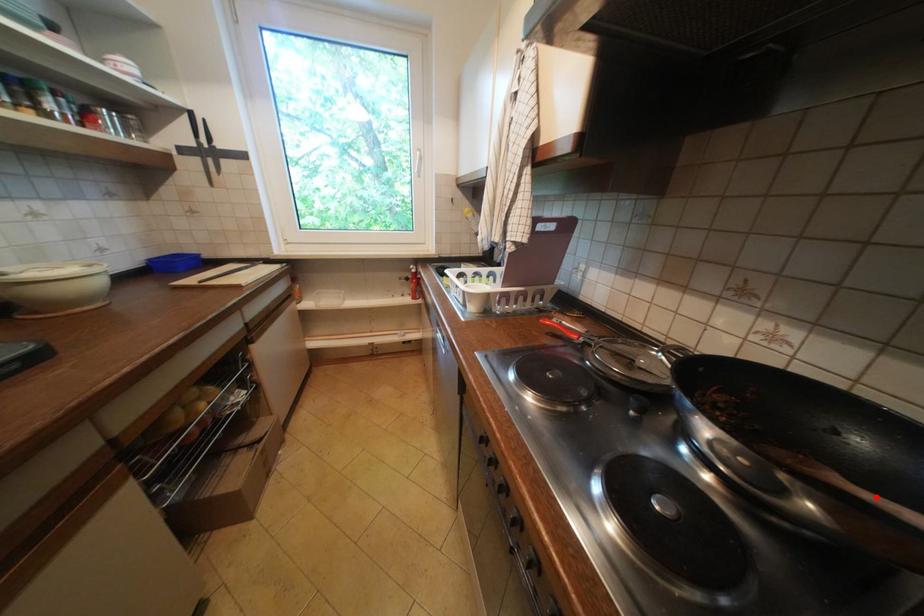
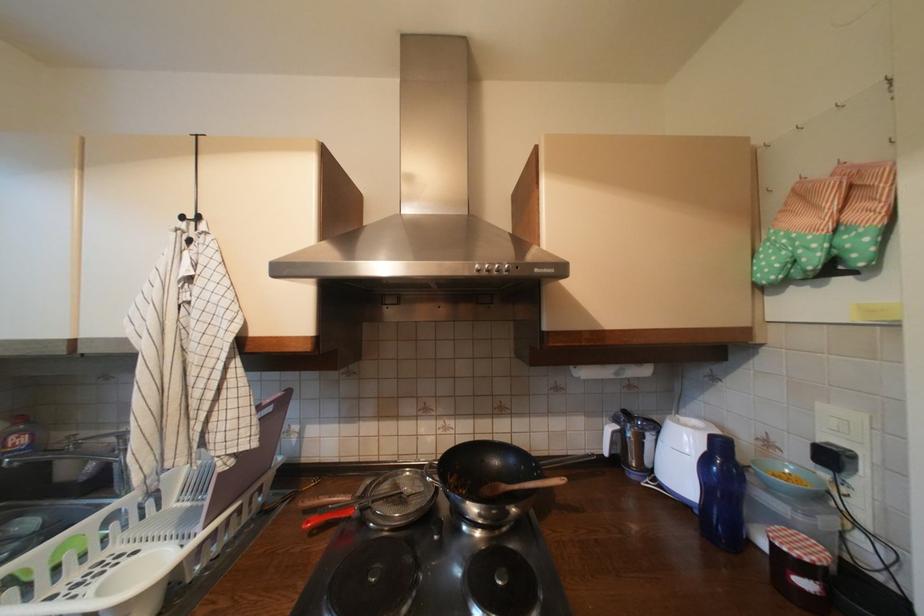
Question: I am providing you with two images of the same scene from different viewpoints. A red point is marked on the first image. At the location where the point appears in image 1, is it still visible in image 2?

Choices:
 (A) Yes
 (B) No

Answer: (A)